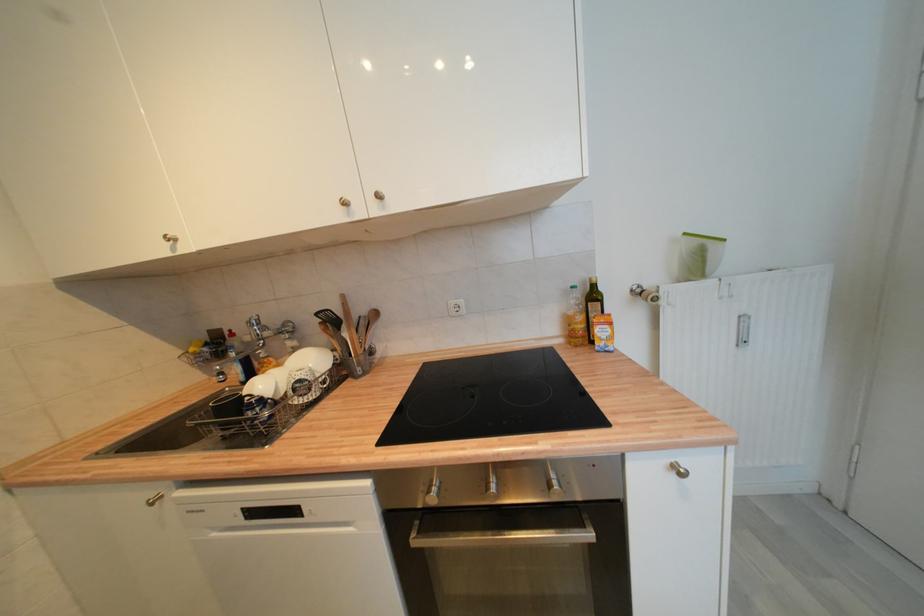
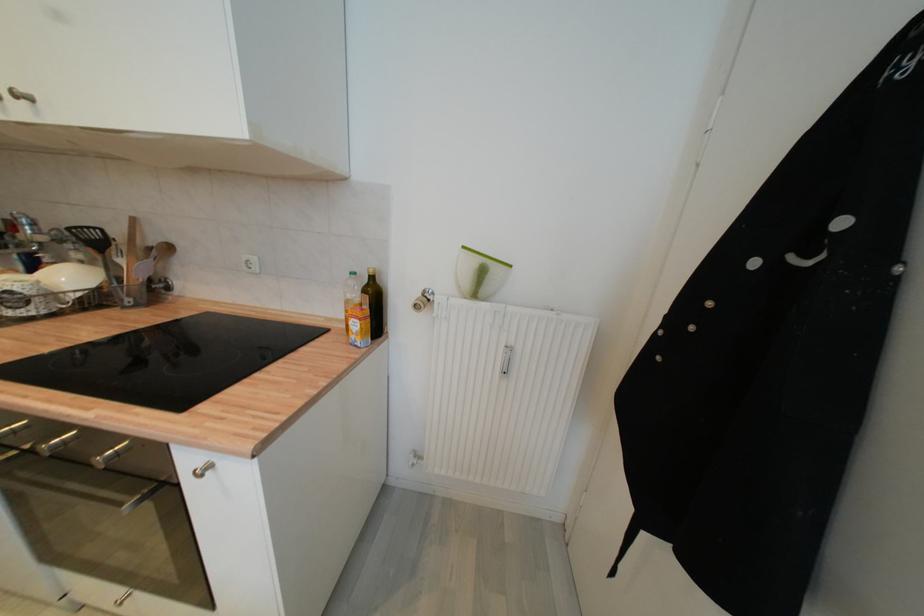
Question: The first image is from the beginning of the video and the second image is from the end. How did the camera likely rotate when shooting the video?

Choices:
 (A) Left
 (B) Right
 (C) Up
 (D) Down

Answer: (D)